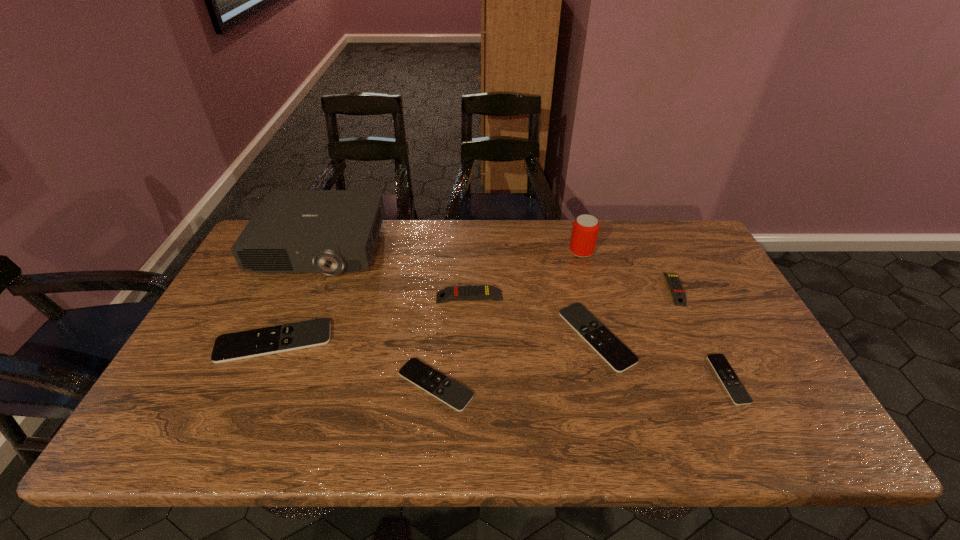
The height and width of the screenshot is (540, 960). Find the location of `vacant space at the left edge of the desktop`. vacant space at the left edge of the desktop is located at coordinates (212, 319).

In the image, there is a desktop. Identify the location of vacant space at the right edge. Image resolution: width=960 pixels, height=540 pixels. coord(695,297).

Locate an element on the screen. This screenshot has width=960, height=540. vacant space at the near left corner is located at coordinates pos(204,434).

The height and width of the screenshot is (540, 960). I want to click on vacant point at the far right corner, so click(684, 219).

The width and height of the screenshot is (960, 540). Find the location of `vacant space at the near right corner`. vacant space at the near right corner is located at coordinates (761, 448).

This screenshot has width=960, height=540. I want to click on vacant space that's between the shortest remote control and the beer can, so click(x=655, y=315).

Identify the location of free area in between the left yellow remote control and the beer can. This screenshot has height=540, width=960. (525, 274).

Image resolution: width=960 pixels, height=540 pixels. I want to click on vacant region between the right yellow remote control and the third biggest black remote control, so [555, 336].

Where is `free spot between the second shortest object and the third black remote control from left to right`? This screenshot has height=540, width=960. free spot between the second shortest object and the third black remote control from left to right is located at coordinates (516, 361).

Image resolution: width=960 pixels, height=540 pixels. What are the coordinates of `free spot between the second shortest object and the right yellow remote control` in the screenshot? It's located at (555, 336).